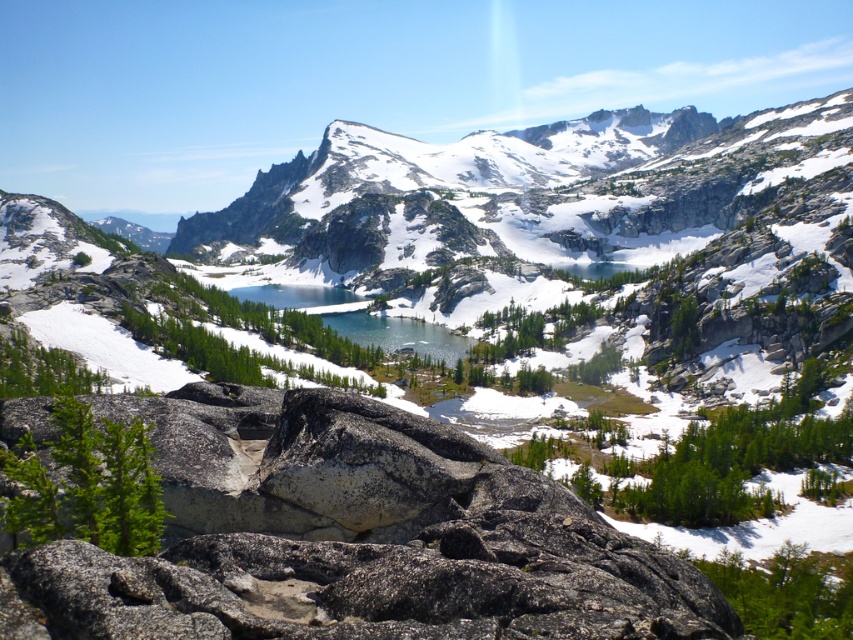
Which is in front, point (244, 452) or point (407, 342)?

Point (244, 452)

Consider the image. Between granite rock at center and clear blue water at center, which one appears on the left side from the viewer's perspective?

From the viewer's perspective, clear blue water at center appears more on the left side.

What do you see at coordinates (352, 536) in the screenshot? Image resolution: width=853 pixels, height=640 pixels. I see `granite rock at center` at bounding box center [352, 536].

Where is `granite rock at center`? granite rock at center is located at coordinates (352, 536).